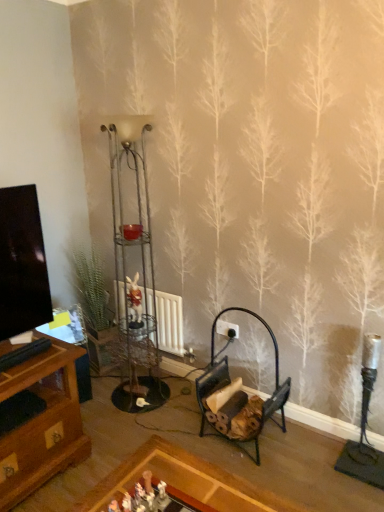
Locate an element on the screen. The width and height of the screenshot is (384, 512). free space in front of black metal firewood rack at lower center is located at coordinates (275, 476).